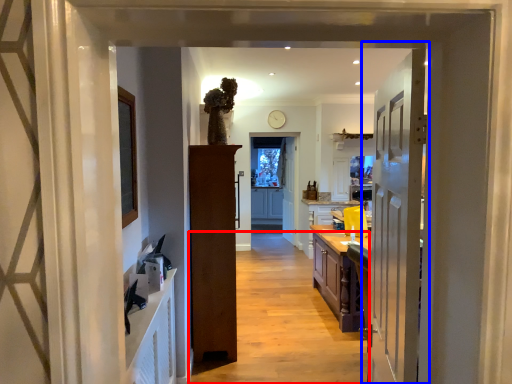
Question: Which object is closer to the camera taking this photo, path (highlighted by a red box) or door (highlighted by a blue box)?

Choices:
 (A) path
 (B) door

Answer: (B)